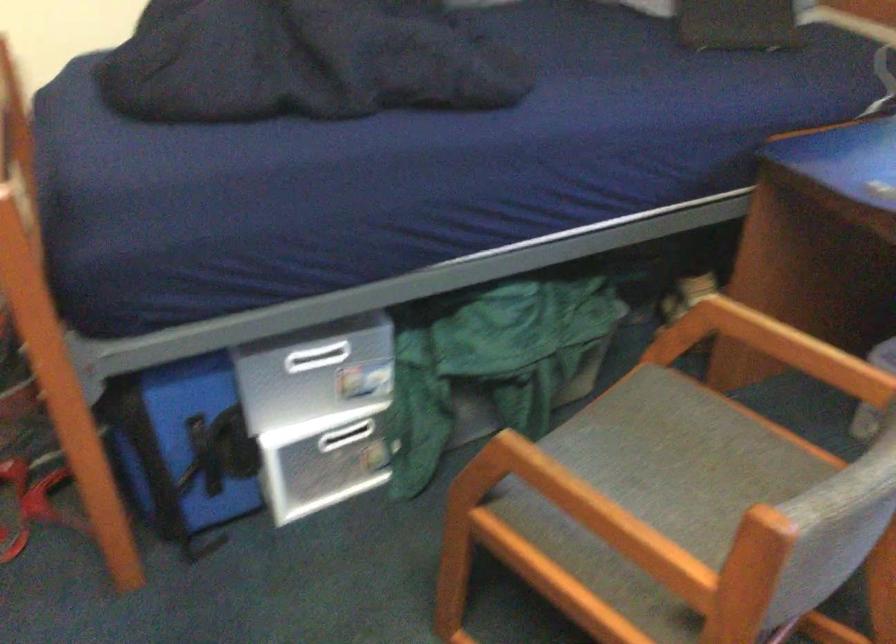
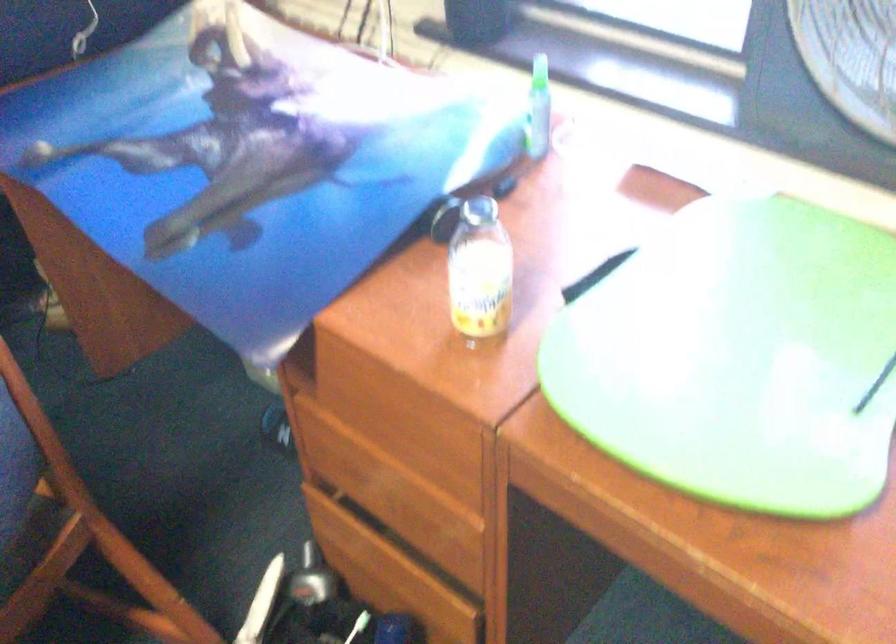
Question: The camera is either moving clockwise (left) or counter-clockwise (right) around the object. The first image is from the beginning of the video and the second image is from the end. Is the camera moving left or right when shooting the video?

Choices:
 (A) Left
 (B) Right

Answer: (A)